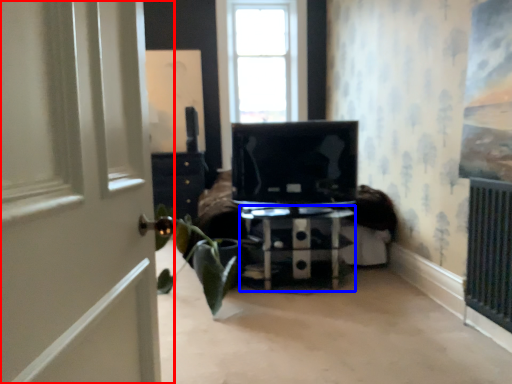
Question: Which object is further to the camera taking this photo, door (highlighted by a red box) or furniture (highlighted by a blue box)?

Choices:
 (A) door
 (B) furniture

Answer: (B)